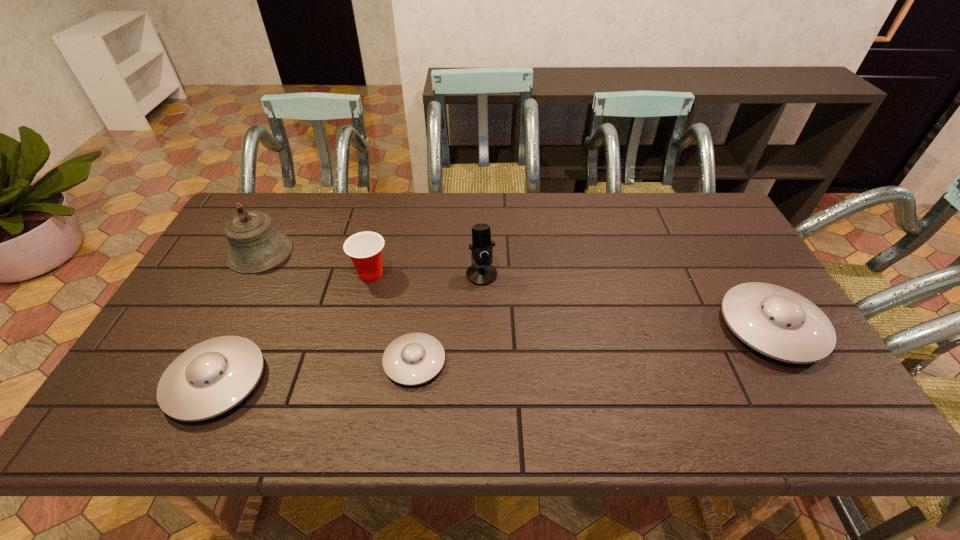
Where is `the second tallest saucer`? The height and width of the screenshot is (540, 960). the second tallest saucer is located at coordinates (210, 378).

Locate an element on the screen. This screenshot has width=960, height=540. the leftmost saucer is located at coordinates (210, 378).

I want to click on the shortest saucer, so click(x=412, y=359).

Identify the location of the second saucer from left to right. Image resolution: width=960 pixels, height=540 pixels. (412, 359).

Image resolution: width=960 pixels, height=540 pixels. I want to click on the rightmost object, so click(x=777, y=322).

Locate an element on the screen. bell is located at coordinates (256, 246).

At what (x,y) coordinates should I click in order to perform the action: click on the second object from right to left. Please return your answer as a coordinate pair (x, y). The width and height of the screenshot is (960, 540). Looking at the image, I should click on (481, 272).

This screenshot has width=960, height=540. In order to click on cup in this screenshot , I will do `click(365, 248)`.

Find the location of a particular element. The width and height of the screenshot is (960, 540). the fourth object from right to left is located at coordinates (365, 248).

This screenshot has height=540, width=960. In order to click on vacant space located 0.050m on the left of the second shortest object in this screenshot , I will do `click(147, 381)`.